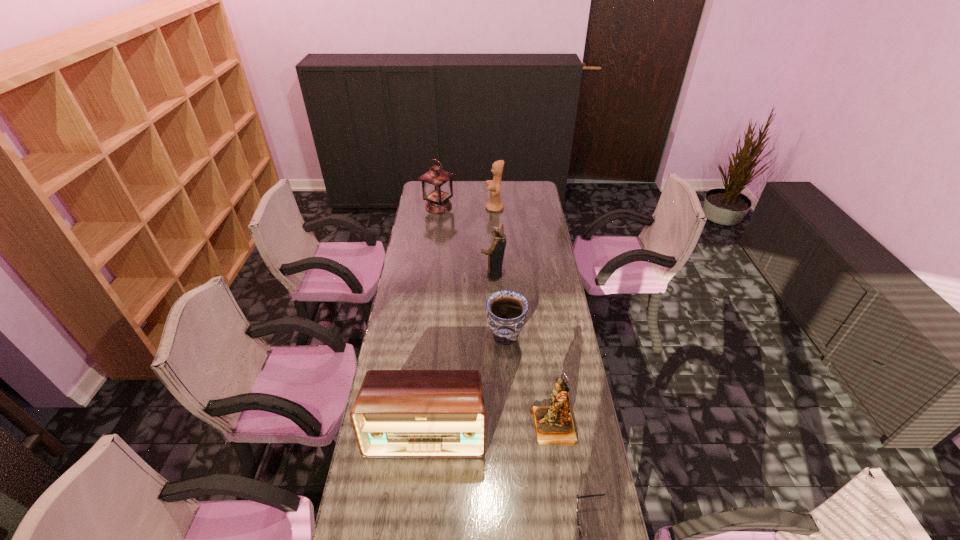
At what (x,y) coordinates should I click in order to perform the action: click on the farthest figurine. Please return your answer as a coordinate pair (x, y). This screenshot has width=960, height=540. Looking at the image, I should click on (494, 186).

Find the location of a particular element. oil lamp is located at coordinates (437, 188).

Where is `the third farthest object`? This screenshot has width=960, height=540. the third farthest object is located at coordinates (495, 253).

This screenshot has height=540, width=960. In order to click on the nearest figurine in this screenshot , I will do `click(554, 425)`.

Identify the location of radio receiver. The image size is (960, 540). (397, 413).

Locate an element on the screen. the second shortest object is located at coordinates (506, 315).

Image resolution: width=960 pixels, height=540 pixels. Identify the location of the fourth farthest object. (506, 315).

Identify the location of vacant space positioned 0.200m on the front-facing side of the farthest figurine. (451, 208).

This screenshot has height=540, width=960. In order to click on vacant area located on the front-facing side of the farthest figurine in this screenshot , I will do pos(464,208).

Where is `free spot located 0.340m on the front-facing side of the farthest figurine`? Image resolution: width=960 pixels, height=540 pixels. free spot located 0.340m on the front-facing side of the farthest figurine is located at coordinates (427, 208).